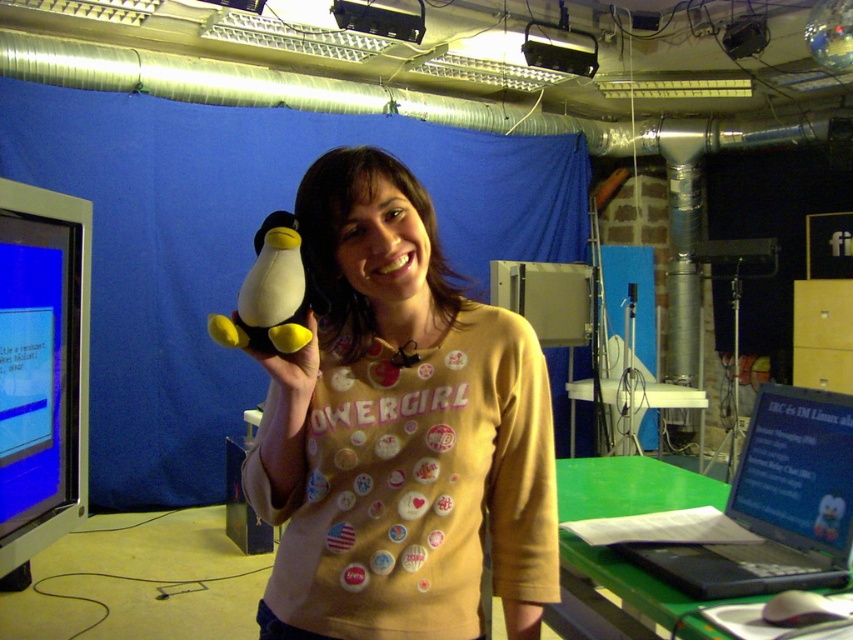
Question: Does blue fabric backdrop at upper left have a greater width compared to black plastic laptop at lower right?

Choices:
 (A) yes
 (B) no

Answer: (A)

Question: Which is nearer to the white plush toy at center?

Choices:
 (A) yellow matte plush toy at upper center
 (B) blue fabric backdrop at upper left
 (C) black plastic laptop at lower right

Answer: (A)

Question: Estimate the real-world distances between objects in this image. Which object is closer to the blue fabric backdrop at upper left?

Choices:
 (A) yellow matte plush toy at center
 (B) black plastic laptop at lower right
 (C) white plush toy at center
 (D) yellow matte plush toy at upper center

Answer: (B)

Question: Does blue fabric backdrop at upper left have a greater width compared to white plush toy at center?

Choices:
 (A) yes
 (B) no

Answer: (A)

Question: Is the position of black plastic laptop at lower right more distant than that of yellow matte plush toy at center?

Choices:
 (A) yes
 (B) no

Answer: (A)

Question: Which object is the closest to the yellow matte plush toy at center?

Choices:
 (A) yellow matte plush toy at upper center
 (B) blue fabric backdrop at upper left

Answer: (A)